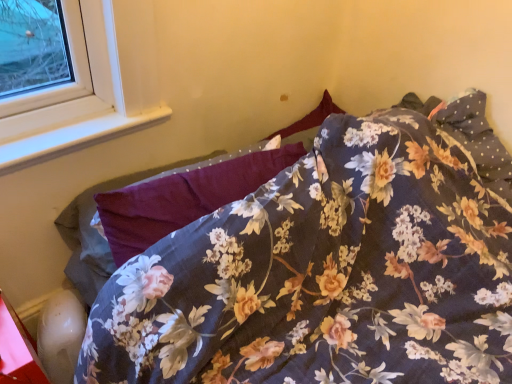
Question: From a real-world perspective, is floral fabric pillow at center positioned above or below floral fabric bed at center?

Choices:
 (A) below
 (B) above

Answer: (B)

Question: Is floral fabric pillow at center to the left or to the right of floral fabric bed at center in the image?

Choices:
 (A) left
 (B) right

Answer: (A)

Question: Estimate the real-world distances between objects in this image. Which object is farther from the white plastic window sill at upper left?

Choices:
 (A) floral fabric bed at center
 (B) floral fabric pillow at center

Answer: (A)

Question: Which object is positioned farthest from the floral fabric pillow at center?

Choices:
 (A) white plastic window sill at upper left
 (B) floral fabric bed at center

Answer: (A)